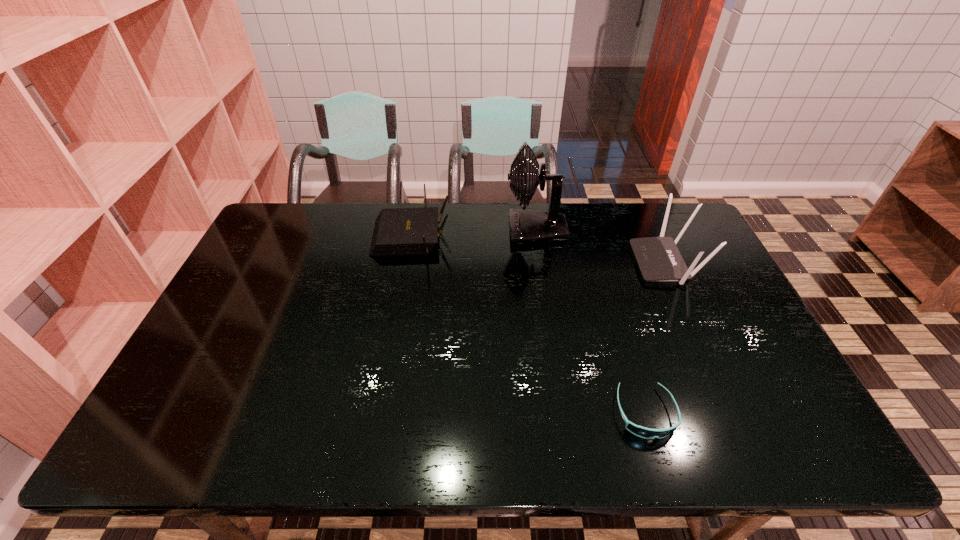
Where is `free space at the near edge of the desktop`? Image resolution: width=960 pixels, height=540 pixels. free space at the near edge of the desktop is located at coordinates (463, 433).

What are the coordinates of `free space at the left edge of the desktop` in the screenshot? It's located at (209, 403).

This screenshot has height=540, width=960. In the image, there is a desktop. In order to click on vacant space at the right edge in this screenshot , I will do `click(681, 252)`.

Find the location of a particular element. vacant position at the far left corner of the desktop is located at coordinates (277, 244).

Where is `vacant space at the far right corner of the desktop`? vacant space at the far right corner of the desktop is located at coordinates (679, 204).

Where is `free area in between the tallest object and the right router`? Image resolution: width=960 pixels, height=540 pixels. free area in between the tallest object and the right router is located at coordinates (601, 247).

Identify the location of free space between the left router and the third object from right to left. (473, 233).

You are a GUI agent. You are given a task and a screenshot of the screen. Output one action in this format:
    pyautogui.click(x=<x>, y=<y>)
    Task: Click on the unoccupied area between the shorter router and the tallest object
    
    Given the screenshot: What is the action you would take?
    pyautogui.click(x=473, y=233)

You are a GUI agent. You are given a task and a screenshot of the screen. Output one action in this format:
    pyautogui.click(x=<x>, y=<y>)
    Task: Click on the empty space between the sunglasses and the second tallest object
    The width and height of the screenshot is (960, 540).
    Given the screenshot: What is the action you would take?
    pyautogui.click(x=656, y=338)

The image size is (960, 540). What are the coordinates of `vacant space in between the third object from left to right and the third object from right to left` in the screenshot? It's located at (590, 322).